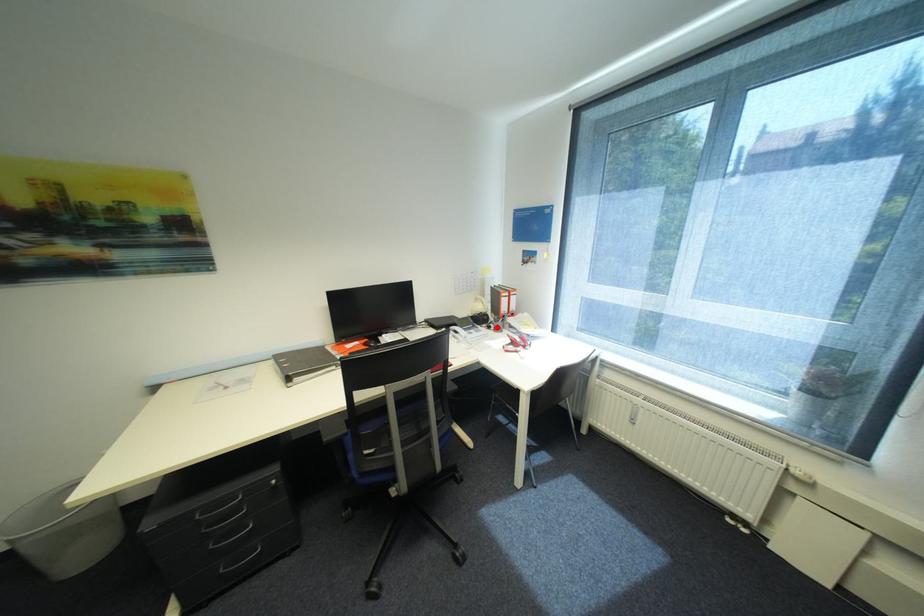
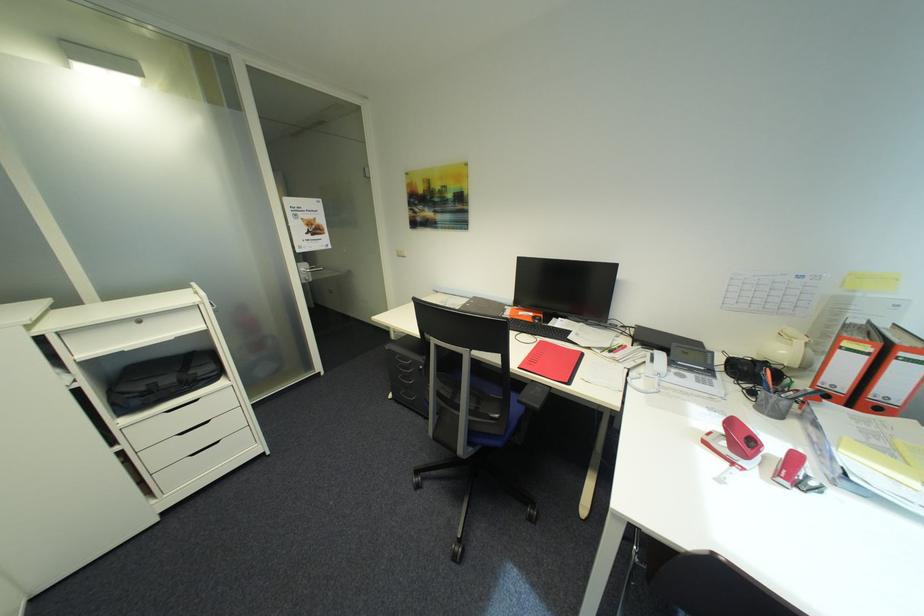
Where in the second image is the point corresponding to the highlighted location from the first image?

(760, 392)